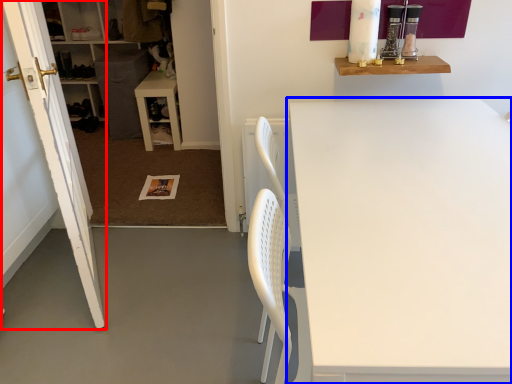
Question: Which point is closer to the camera, door (highlighted by a red box) or table (highlighted by a blue box)?

Choices:
 (A) door
 (B) table

Answer: (B)